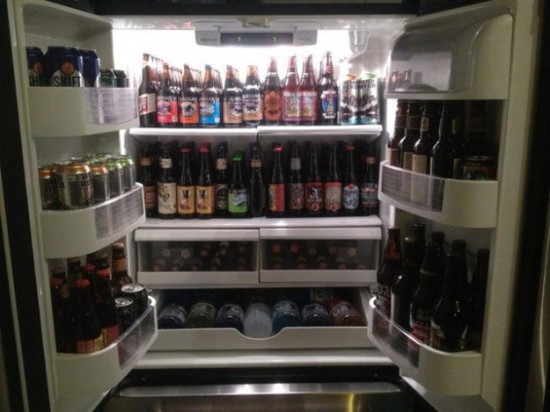
Where is `shelf`? The image size is (550, 412). shelf is located at coordinates (78, 237).